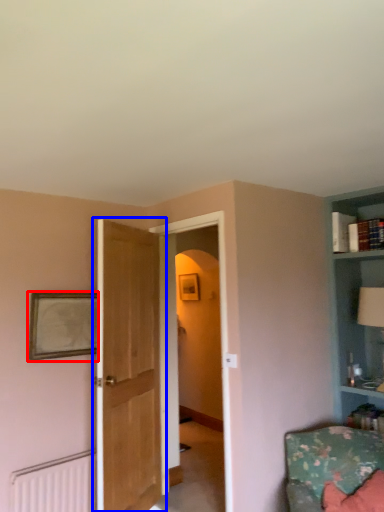
Question: Which point is closer to the camera, picture frame (highlighted by a red box) or door (highlighted by a blue box)?

Choices:
 (A) picture frame
 (B) door

Answer: (B)